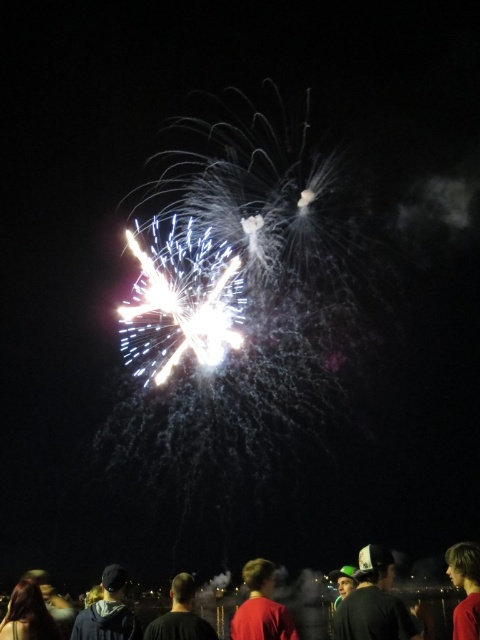
Does point (332, 627) come behind point (259, 582)?

That is True.

Can you confirm if red shirt at lower center is bigger than red matte shirt at center?

Indeed, red shirt at lower center has a larger size compared to red matte shirt at center.

Who is more distant from viewer, (179,593) or (288,611)?

The point (179,593) is more distant.

The height and width of the screenshot is (640, 480). Find the location of `red shirt at lower center`. red shirt at lower center is located at coordinates (377, 604).

Is point (105, 602) farther from camera compared to point (192, 625)?

Yes, point (105, 602) is farther from viewer.

Is dark blue hoodie at lower left above black matte shirt at lower center?

Indeed, dark blue hoodie at lower left is positioned over black matte shirt at lower center.

This screenshot has width=480, height=640. What do you see at coordinates (108, 611) in the screenshot? I see `dark blue hoodie at lower left` at bounding box center [108, 611].

The height and width of the screenshot is (640, 480). What are the coordinates of `dark blue hoodie at lower left` in the screenshot? It's located at (108, 611).

Can you confirm if green cap at lower right is positioned to the right of blonde hair at lower right?

Incorrect, green cap at lower right is not on the right side of blonde hair at lower right.

Between green cap at lower right and blonde hair at lower right, which one appears on the right side from the viewer's perspective?

blonde hair at lower right

The height and width of the screenshot is (640, 480). I want to click on green cap at lower right, so click(x=374, y=602).